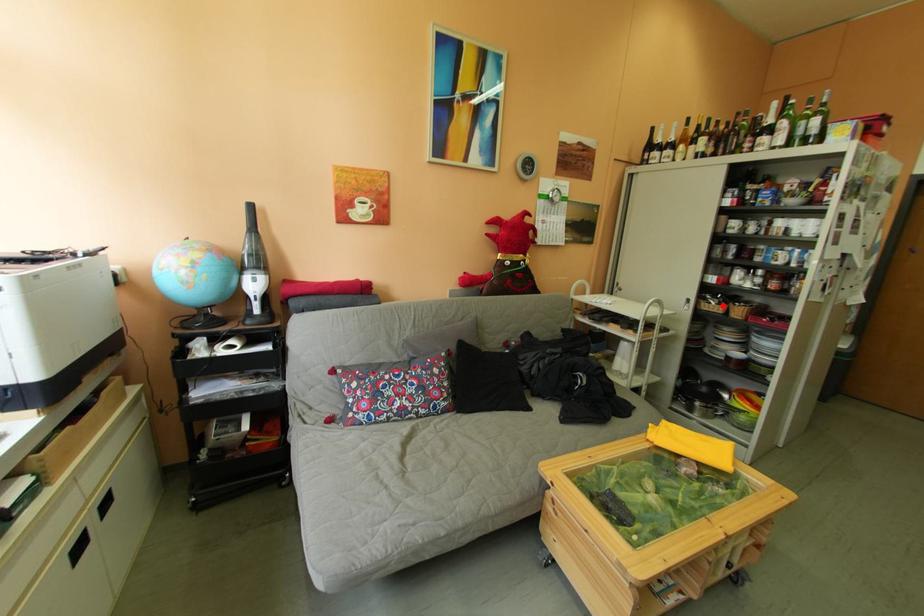
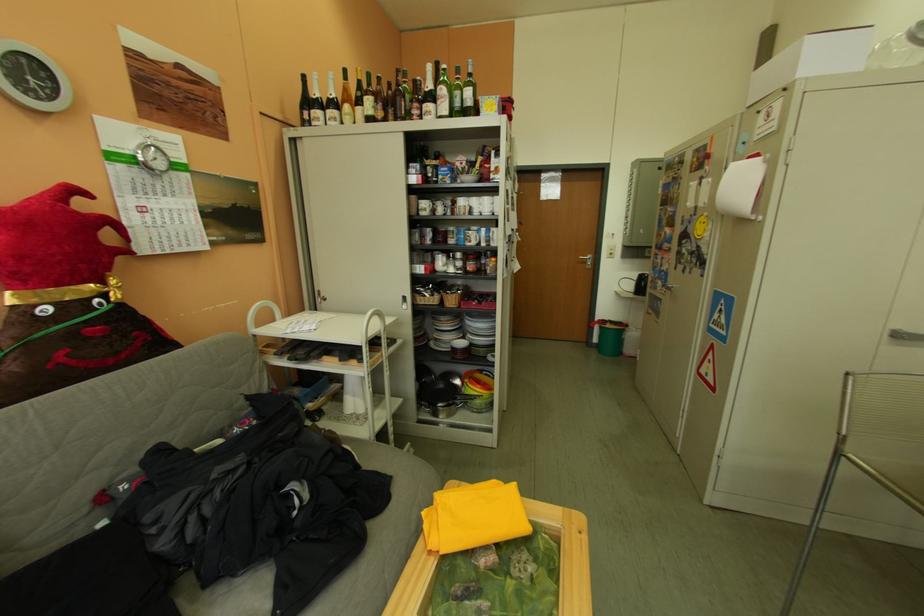
In the second image, find the point that corresponds to the highlighted location in the first image.

(438, 299)